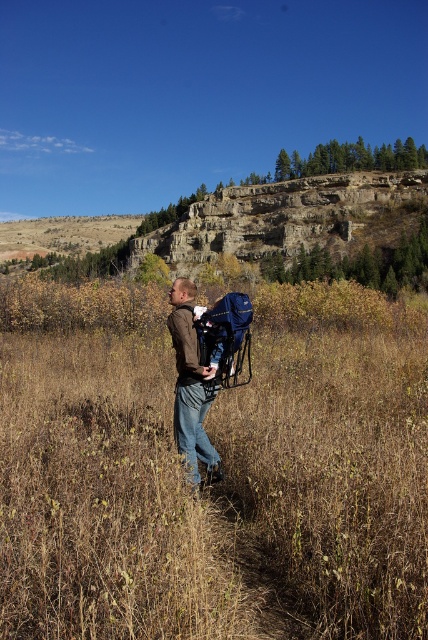
You are the man in the image. You want to place a small backpack on the ground near you. Where should you put it so that it won not be hidden by the brown dry grass at center or the brown leather jacket at center?

You should place the small backpack behind both the brown dry grass at center and the brown leather jacket at center since the brown dry grass at center is in front of the brown leather jacket at center, so placing it behind both ensures it remains visible.

You are a hiker who needs to cross the field. The brown dry grass at center and the brown leather jacket at center are in your path. Which object is larger and might obstruct your path more?

The brown dry grass at center is bigger than the brown leather jacket at center, so it might obstruct your path more.

You are a hiker who needs to cross the field. You see the brown dry grass at center and the brown leather jacket at center. Which object is closer to your current position?

The brown dry grass at center and brown leather jacket at center are 21.51 meters apart from each other, so it depends on your exact position. However, since both are at the center, they are likely equidistant from your current position in the field.